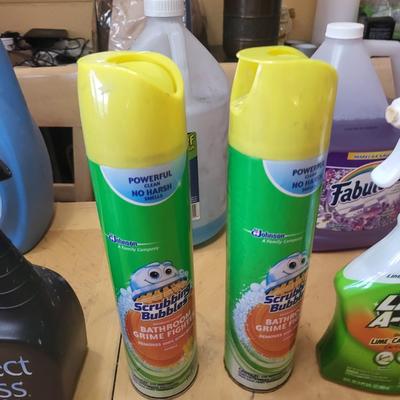
Where is `spray bottle trigger`? The image size is (400, 400). spray bottle trigger is located at coordinates (393, 173).